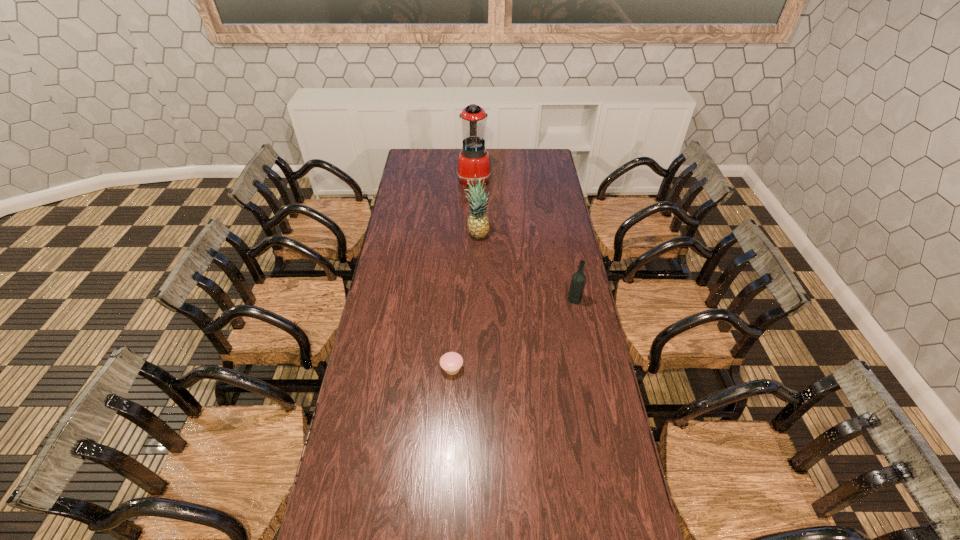
You are a GUI agent. You are given a task and a screenshot of the screen. Output one action in this format:
    pyautogui.click(x=<x>, y=<y>)
    Task: Click on the food processor
    This screenshot has height=540, width=960.
    Given the screenshot: What is the action you would take?
    pyautogui.click(x=473, y=159)

The height and width of the screenshot is (540, 960). What are the coordinates of `the tallest object` in the screenshot? It's located at (473, 159).

This screenshot has width=960, height=540. I want to click on the second farthest object, so click(x=478, y=224).

Locate an element on the screen. pineapple is located at coordinates (478, 224).

Find the location of a particular element. the second shortest object is located at coordinates point(578,280).

Find the location of a particular element. The height and width of the screenshot is (540, 960). vodka is located at coordinates (578, 280).

At what (x,y) coordinates should I click in order to perform the action: click on cupcake. Please return your answer as a coordinate pair (x, y). The image size is (960, 540). Looking at the image, I should click on (451, 362).

What are the coordinates of `the shortest object` in the screenshot? It's located at (451, 362).

I want to click on free space located 0.140m on the controls of the farthest object, so click(x=516, y=178).

Locate an element on the screen. The height and width of the screenshot is (540, 960). vacant space located 0.160m on the front of the pineapple is located at coordinates (477, 265).